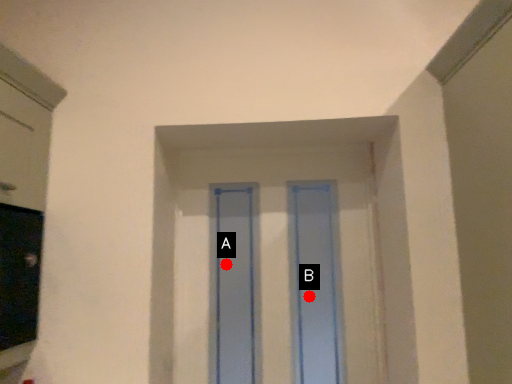
Question: Two points are circled on the image, labeled by A and B beside each circle. Which of the following is the farthest from the observer?

Choices:
 (A) A is further
 (B) B is further

Answer: (A)